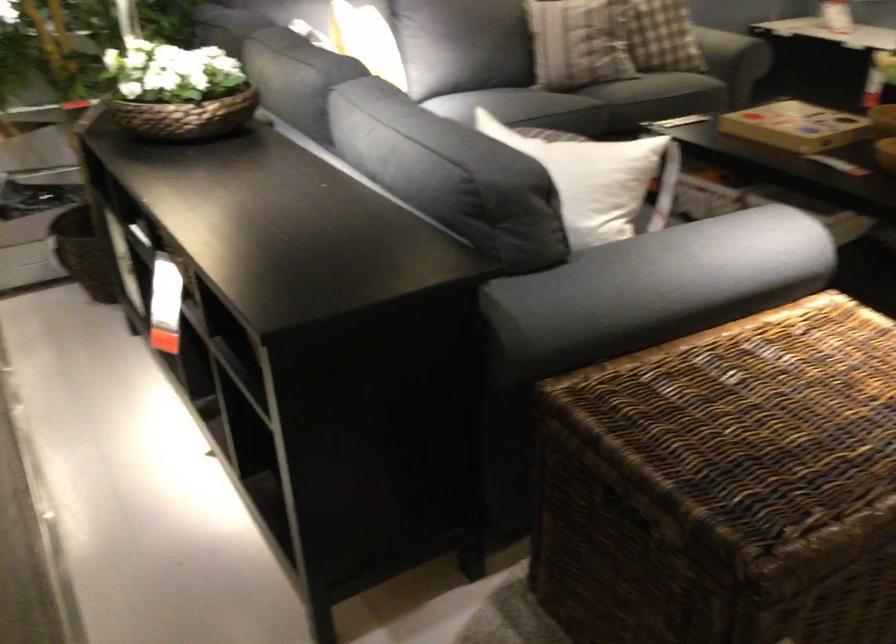
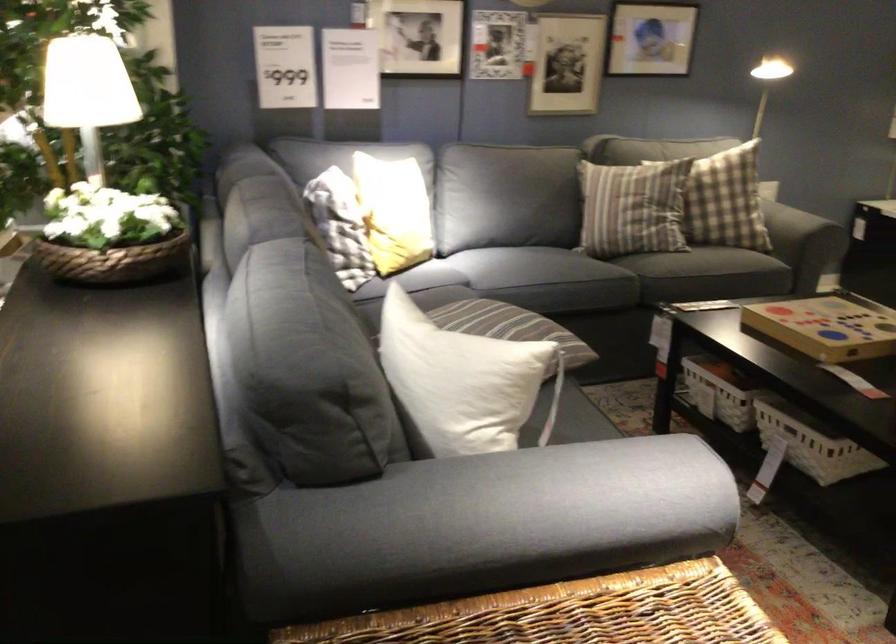
The point at (588, 181) is marked in the first image. Where is the corresponding point in the second image?

(462, 381)